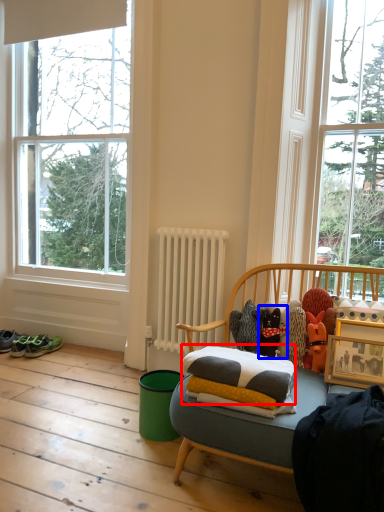
Question: Which object is further to the camera taking this photo, pillow (highlighted by a red box) or toy (highlighted by a blue box)?

Choices:
 (A) pillow
 (B) toy

Answer: (B)